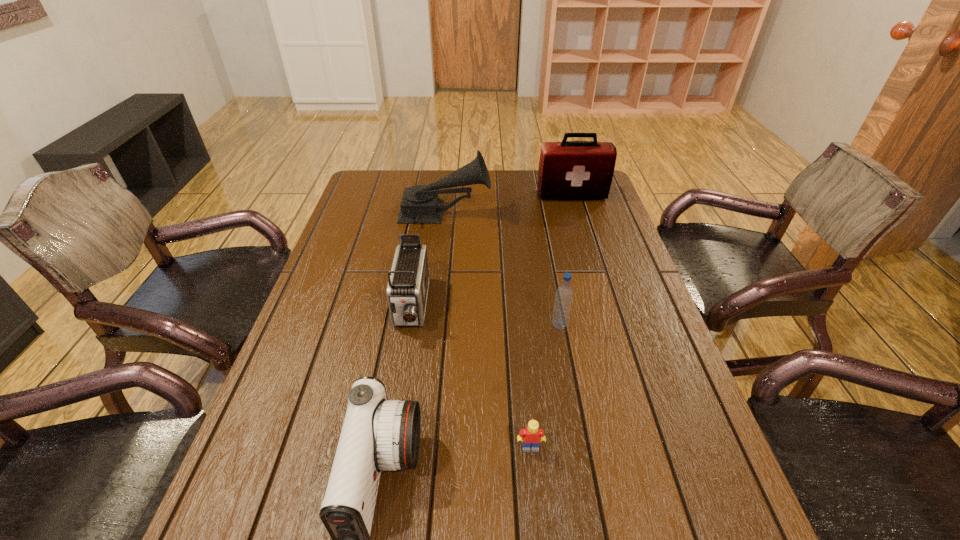
Identify the location of vacant space situated 0.070m on the front-facing side of the Lego. The image size is (960, 540). (534, 489).

The height and width of the screenshot is (540, 960). I want to click on the first aid kit located at the far edge, so click(x=569, y=170).

The image size is (960, 540). What are the coordinates of `phonograph_record at the far edge` in the screenshot? It's located at (420, 204).

Where is `object that is at the right edge`? This screenshot has width=960, height=540. object that is at the right edge is located at coordinates (569, 170).

Where is `object at the far right corner`? object at the far right corner is located at coordinates (569, 170).

Locate an element on the screen. The image size is (960, 540). free spot at the far edge of the desktop is located at coordinates (517, 185).

At what (x,y) coordinates should I click in order to perform the action: click on vacant region at the left edge of the desktop. Please return your answer as a coordinate pair (x, y). The image size is (960, 540). Looking at the image, I should click on (264, 433).

Identify the location of vacant region at the right edge of the desktop. This screenshot has height=540, width=960. (610, 342).

Identify the location of vacant area at the far right corner. (606, 200).

Where is `vacant area between the water bottle and the phonograph_record`? This screenshot has height=540, width=960. vacant area between the water bottle and the phonograph_record is located at coordinates 502,269.